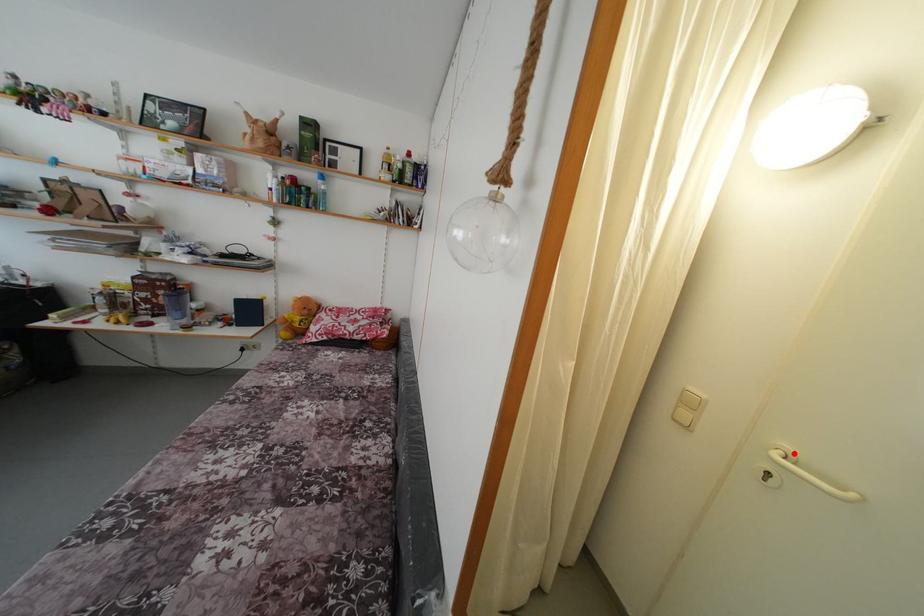
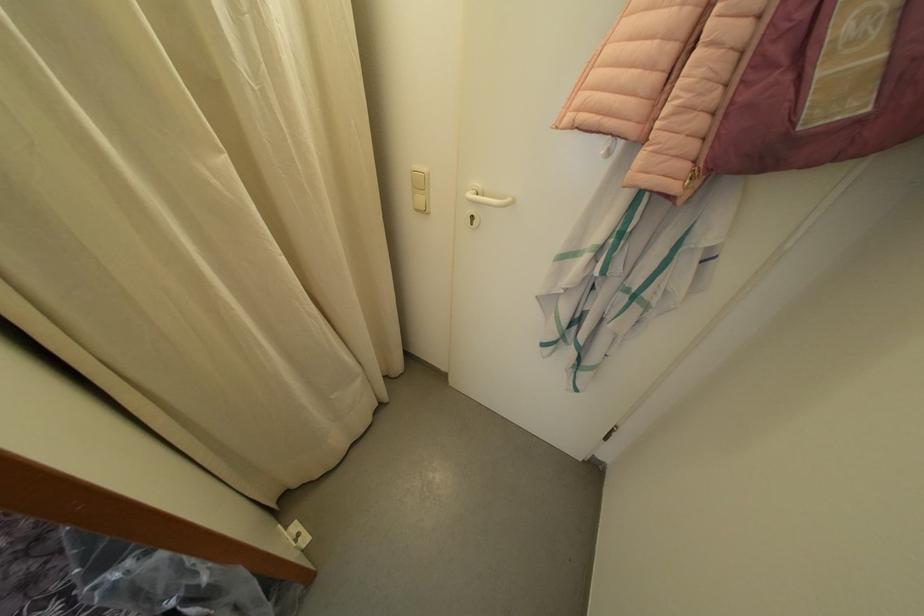
In the second image, find the point that corresponds to the highlighted location in the first image.

(482, 190)